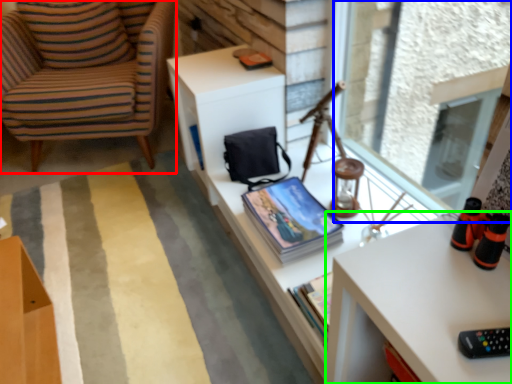
Question: Based on their relative distances, which object is nearer to chair (highlighted by a red box)? Choose from window screen (highlighted by a blue box) and desk (highlighted by a green box).

Choices:
 (A) window screen
 (B) desk

Answer: (A)